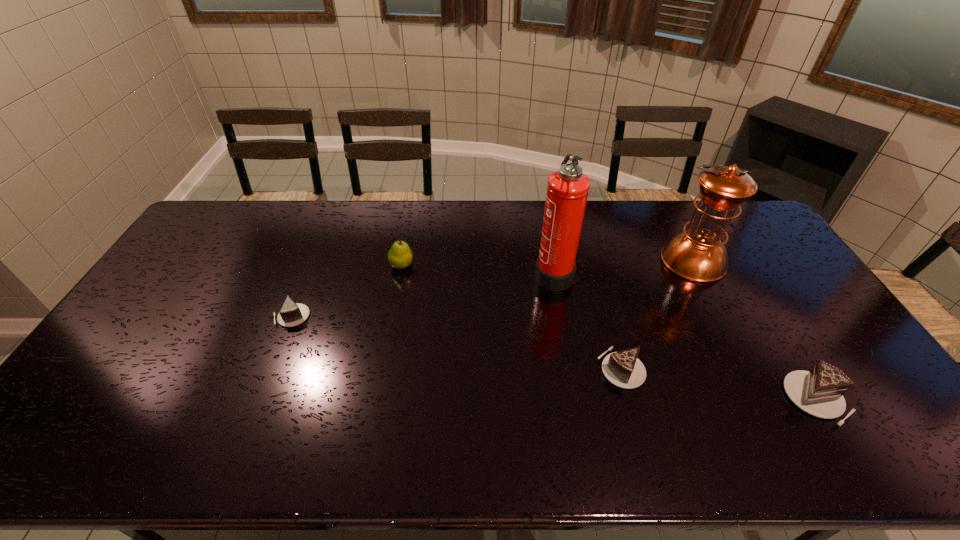
Image resolution: width=960 pixels, height=540 pixels. I want to click on free spot between the second tallest object and the tallest chocolate cake, so click(x=755, y=330).

Locate an element on the screen. The height and width of the screenshot is (540, 960). free space between the third shortest object and the third nearest object is located at coordinates (554, 357).

I want to click on vacant region between the second tallest object and the second chocolate cake from right to left, so click(657, 314).

Find the location of a particular element. The height and width of the screenshot is (540, 960). vacant area that lies between the shortest object and the fifth tallest object is located at coordinates (456, 342).

I want to click on vacant space that is in between the tallest chocolate cake and the tallest object, so coord(684,336).

Identify which object is located as the nearest to the pear. Please provide its 2D coordinates. Your answer should be formatted as a tuple, i.e. [(x, y)], where the tuple contains the x and y coordinates of a point satisfying the conditions above.

[(291, 314)]

Select which object is the fourth closest to the tallest chocolate cake. Please provide its 2D coordinates. Your answer should be formatted as a tuple, i.e. [(x, y)], where the tuple contains the x and y coordinates of a point satisfying the conditions above.

[(400, 256)]

Point out which chocolate cake is positioned as the second nearest to the fifth tallest object. Please provide its 2D coordinates. Your answer should be formatted as a tuple, i.e. [(x, y)], where the tuple contains the x and y coordinates of a point satisfying the conditions above.

[(291, 314)]

Where is `chocolate cake that can be found as the second closest to the third object from right to left`? The width and height of the screenshot is (960, 540). chocolate cake that can be found as the second closest to the third object from right to left is located at coordinates (291, 314).

Where is `free location that satisfies the following two spatial constraints: 1. on the front-facing side of the fire extinguisher; 2. on the back side of the rightmost chocolate cake`? The width and height of the screenshot is (960, 540). free location that satisfies the following two spatial constraints: 1. on the front-facing side of the fire extinguisher; 2. on the back side of the rightmost chocolate cake is located at coordinates (575, 399).